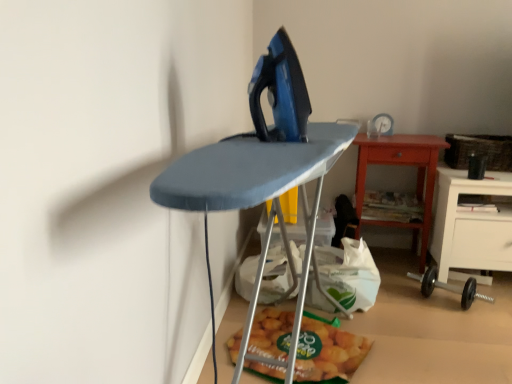
You are a GUI agent. You are given a task and a screenshot of the screen. Output one action in this format:
    pyautogui.click(x=<x>, y=<y>)
    Task: Click on the free point below wooden table at center right (from a real-world perspective)
    The height and width of the screenshot is (384, 512).
    Given the screenshot: What is the action you would take?
    pyautogui.click(x=396, y=259)